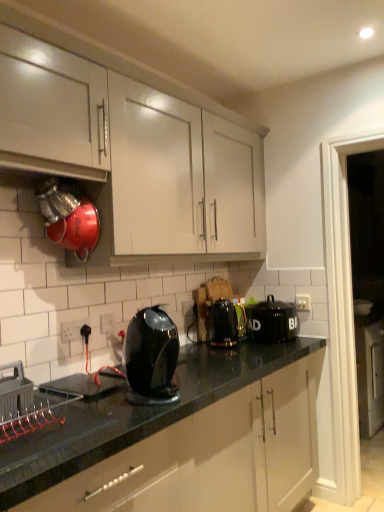
Question: From the image's perspective, is white plastic electric outlet at center, placed as the 1th electric outlet when sorted from right to left, located above or below white plastic electric outlet at lower left, the 1th electric outlet when ordered from left to right?

Choices:
 (A) below
 (B) above

Answer: (B)

Question: In terms of size, does white plastic electric outlet at center, the first electric outlet viewed from the back, appear bigger or smaller than white plastic electric outlet at lower left, the 1th electric outlet when ordered from left to right?

Choices:
 (A) big
 (B) small

Answer: (B)

Question: Considering the real-world distances, which object is farthest from the black matte bread bin at center, which ranks as the first kitchen appliance in right-to-left order?

Choices:
 (A) black metallic kettle at center, arranged as the second kitchen appliance when viewed from the right
 (B) white plastic electric outlet at lower center, positioned as the second electric outlet in back-to-front order
 (C) white matte cabinet at upper left
 (D) metallic gray crate at lower left
 (E) black glossy kettle at center, which is the third kitchen appliance in back-to-front order

Answer: (D)

Question: Which of these objects is positioned closest to the white plastic electric outlet at center, the first electric outlet viewed from the back?

Choices:
 (A) metallic gray crate at lower left
 (B) white plastic electric outlet at lower left, the 1th electric outlet viewed from the front
 (C) black metallic kettle at center, positioned as the second kitchen appliance in back-to-front order
 (D) black matte bread bin at center, placed as the 3th kitchen appliance when sorted from left to right
 (E) black glossy kettle at center, acting as the 1th kitchen appliance starting from the left

Answer: (C)